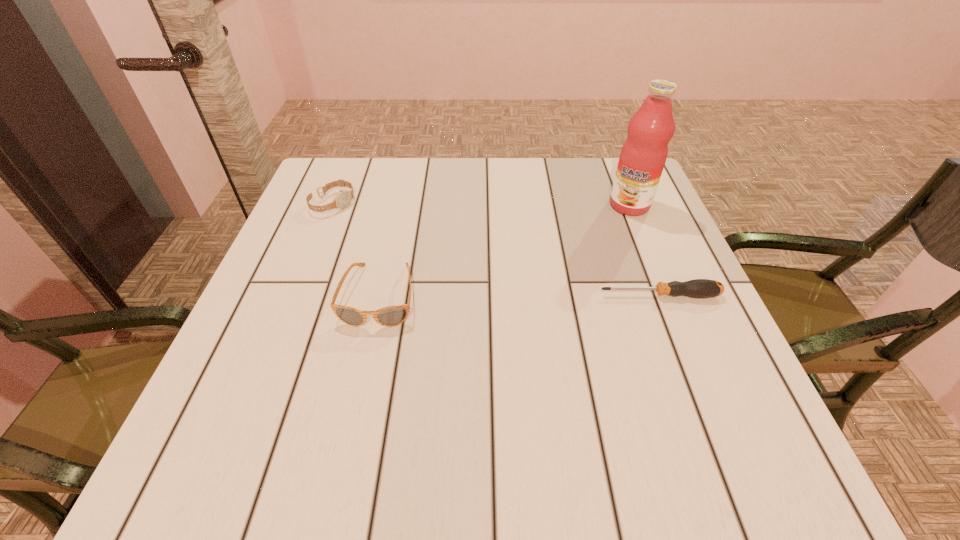
The height and width of the screenshot is (540, 960). Find the location of `free spot on the desktop that is between the third object from right to left and the screwdriver and is positioned on the label of the fruit juice`. free spot on the desktop that is between the third object from right to left and the screwdriver and is positioned on the label of the fruit juice is located at coordinates (555, 295).

This screenshot has height=540, width=960. I want to click on free space on the desktop that is between the sunglasses and the screwdriver and is positioned on the face of the leftmost object, so click(504, 295).